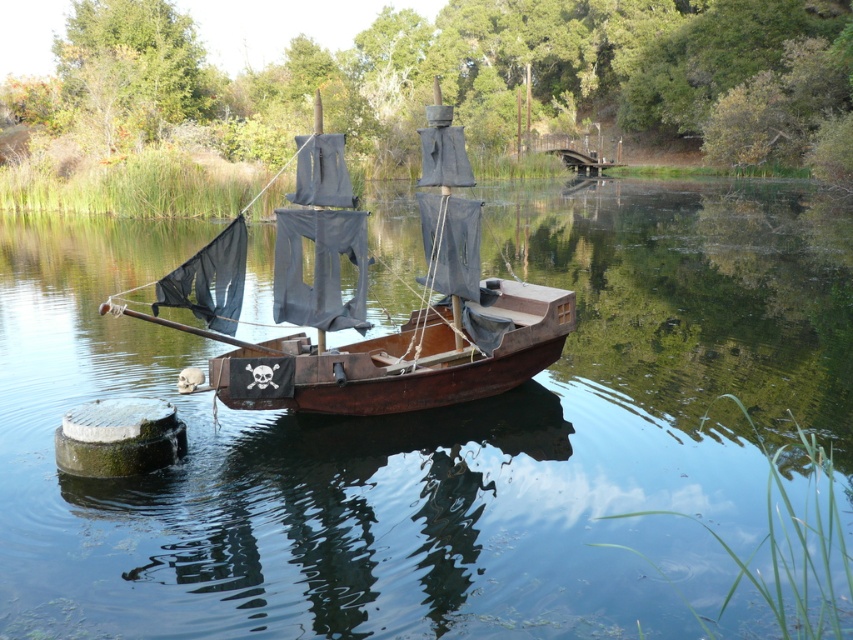
Question: Can you confirm if transparent water at center is positioned above rusty wood sailboat at center?

Choices:
 (A) yes
 (B) no

Answer: (A)

Question: Where is transparent water at center located in relation to rusty wood sailboat at center in the image?

Choices:
 (A) below
 (B) above

Answer: (B)

Question: Can you confirm if transparent water at center is positioned above rusty wood sailboat at center?

Choices:
 (A) yes
 (B) no

Answer: (A)

Question: Which object is closer to the camera taking this photo?

Choices:
 (A) transparent water at center
 (B) rusty wood sailboat at center

Answer: (A)